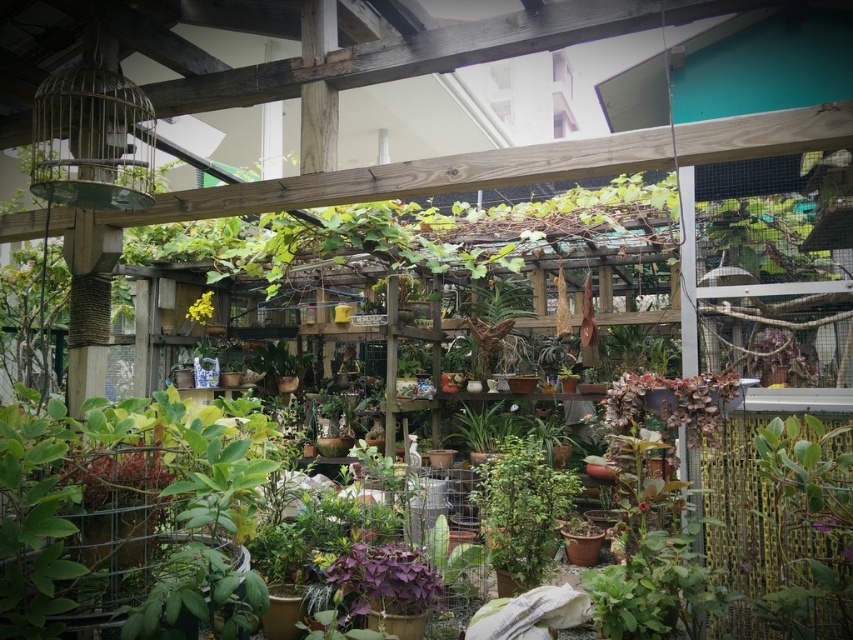
You are standing in the indoor garden and want to locate the green matte plant at center. According to the coordinates provided, where would you find it?

The green matte plant at center is located at the 2D coordinates point (521, 508).

You are a gardener who wants to place a decorative statue between the green matte plant at center and the yellow matte flower at center. Since both are at the center, which one should you position the statue closer to so that it stands out more?

The green matte plant at center is taller than the yellow matte flower at center. To make the statue stand out more, position it closer to the shorter yellow matte flower at center so it contrasts against the taller plant.